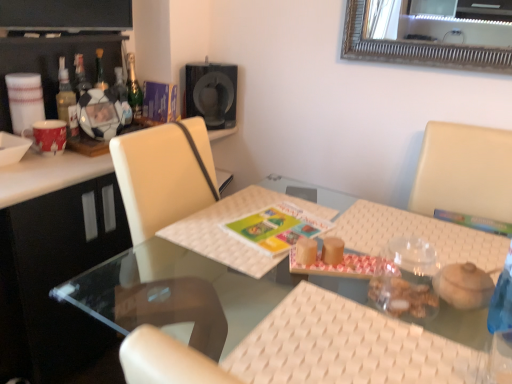
Identify the location of vacant area to the right of white matte bowl at upper left. (52, 163).